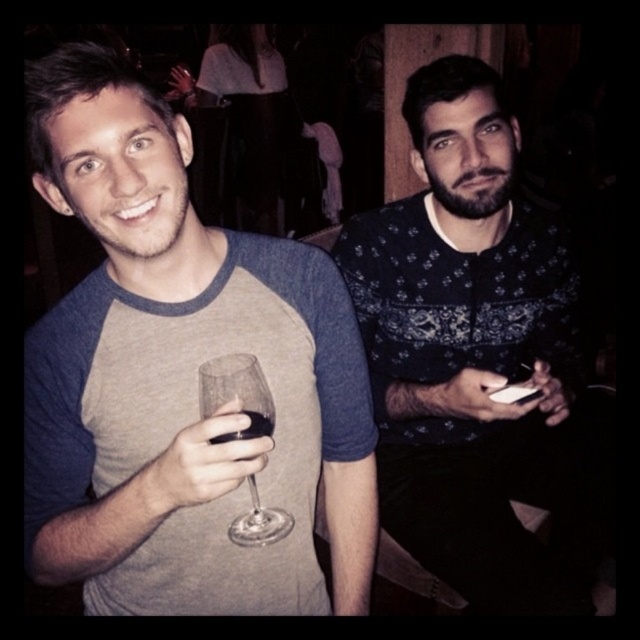
Does transparent glass at center have a larger size compared to clear glass wine at center?

Correct, transparent glass at center is larger in size than clear glass wine at center.

Based on the photo, measure the distance between point (x=164, y=513) and camera.

Point (x=164, y=513) and camera are 25.06 inches apart.

This screenshot has width=640, height=640. Identify the location of transparent glass at center. pos(202,461).

Does floral-patterned sweater at center appear on the left side of white matte phone at center?

In fact, floral-patterned sweater at center is to the right of white matte phone at center.

Is floral-patterned sweater at center below white matte phone at center?

No.

Is point (508, 292) positioned behind point (529, 406)?

Yes, it is behind point (529, 406).

This screenshot has width=640, height=640. I want to click on floral-patterned sweater at center, so click(x=467, y=346).

Can you confirm if transparent glass at left is smaller than white matte phone at center?

Indeed, transparent glass at left has a smaller size compared to white matte phone at center.

Locate an element on the screen. transparent glass at left is located at coordinates pyautogui.click(x=236, y=394).

Does point (244, 384) come farther from viewer compared to point (522, 408)?

No, it is not.

Image resolution: width=640 pixels, height=640 pixels. In order to click on transparent glass at left in this screenshot , I will do `click(236, 394)`.